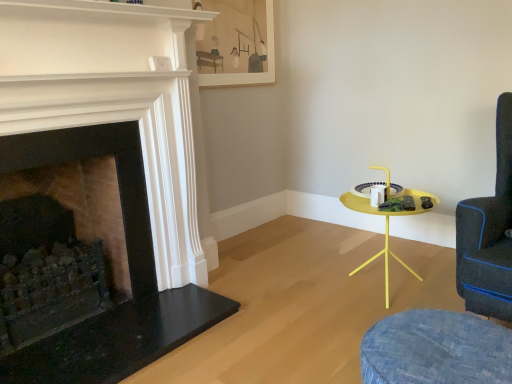
Question: Considering the positions of denim swivel chair at lower right, acting as the second swivel chair starting from the right, and dark blue fabric swivel chair at right, the first swivel chair in the right-to-left sequence, in the image, is denim swivel chair at lower right, acting as the second swivel chair starting from the right, taller or shorter than dark blue fabric swivel chair at right, the first swivel chair in the right-to-left sequence,?

Choices:
 (A) tall
 (B) short

Answer: (B)

Question: Considering the positions of denim swivel chair at lower right, the 1th swivel chair when ordered from left to right, and dark blue fabric swivel chair at right, which is the second swivel chair from left to right, in the image, is denim swivel chair at lower right, the 1th swivel chair when ordered from left to right, wider or thinner than dark blue fabric swivel chair at right, which is the second swivel chair from left to right,?

Choices:
 (A) wide
 (B) thin

Answer: (B)

Question: Estimate the real-world distances between objects in this image. Which object is farther from the dark blue fabric swivel chair at right, which is the second swivel chair from left to right?

Choices:
 (A) yellow matte side table at right
 (B) dark stone fireplace at left, acting as the second fireplace starting from the right
 (C) denim swivel chair at lower right, acting as the second swivel chair starting from the right
 (D) matte wooden picture frame at upper center
 (E) matte black fireplace at left, which is the 2th fireplace from left to right

Answer: (D)

Question: Estimate the real-world distances between objects in this image. Which object is closer to the denim swivel chair at lower right, acting as the second swivel chair starting from the right?

Choices:
 (A) yellow matte side table at right
 (B) dark stone fireplace at left, acting as the second fireplace starting from the right
 (C) dark blue fabric swivel chair at right, the first swivel chair in the right-to-left sequence
 (D) matte wooden picture frame at upper center
 (E) matte black fireplace at left, which is the 2th fireplace from left to right

Answer: (C)